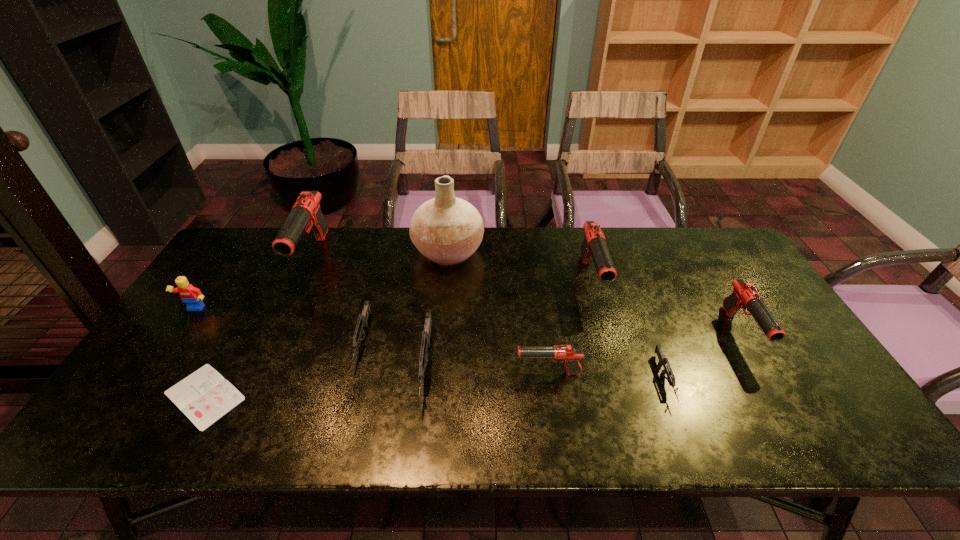
You are a GUI agent. You are given a task and a screenshot of the screen. Output one action in this format:
    pyautogui.click(x=<x>, y=<y>)
    Task: Click on the pottery that is at the far edge
    This screenshot has height=540, width=960.
    Given the screenshot: What is the action you would take?
    pyautogui.click(x=447, y=230)

Find the location of a particular element. This screenshot has width=960, height=540. gun at the near edge is located at coordinates (426, 334).

Locate an element on the screen. The image size is (960, 540). diary that is at the near edge is located at coordinates (204, 396).

Where is `Lego present at the left edge`? Lego present at the left edge is located at coordinates (192, 296).

Image resolution: width=960 pixels, height=540 pixels. Find the location of `diary present at the left edge`. diary present at the left edge is located at coordinates (204, 396).

The height and width of the screenshot is (540, 960). Find the location of `object located in the right edge section of the desktop`. object located in the right edge section of the desktop is located at coordinates (745, 295).

In order to click on object present at the near left corner in this screenshot , I will do coord(204,396).

This screenshot has width=960, height=540. I want to click on vacant space at the far edge of the desktop, so click(624, 235).

Locate an element on the screen. vacant region at the near edge of the desktop is located at coordinates (323, 433).

Where is `free space at the left edge`? free space at the left edge is located at coordinates (162, 360).